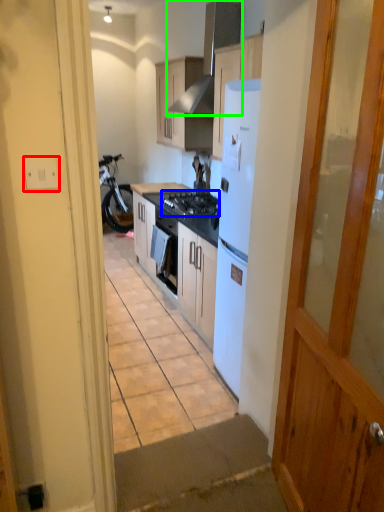
Question: Considering the real-world distances, which object is farthest from electric outlet (highlighted by a red box)? gas stove (highlighted by a blue box) or kitchen appliance (highlighted by a green box)?

Choices:
 (A) gas stove
 (B) kitchen appliance

Answer: (B)